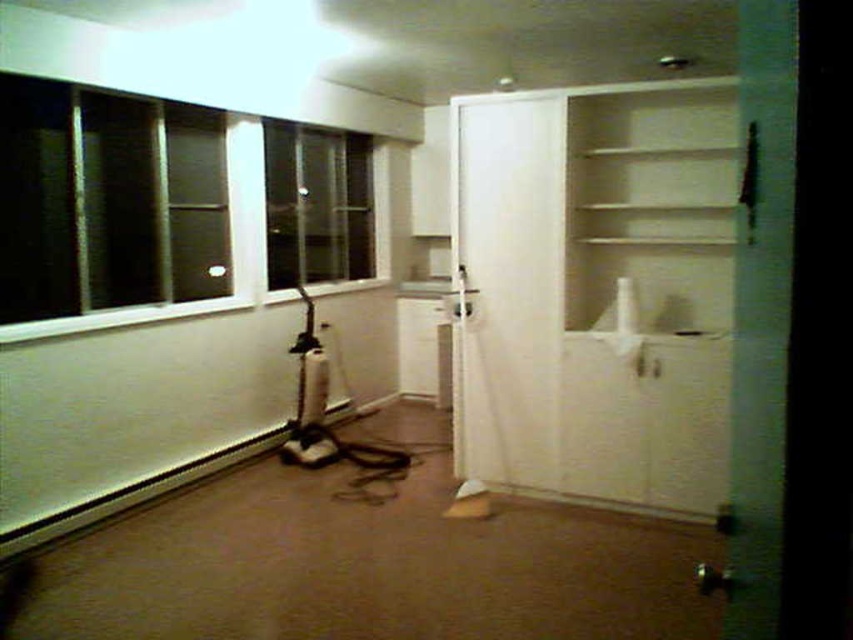
You are a delivery person who needs to place a large box in this room. The box is wider than the white matte cabinet at center. Can you fit the box through the clear glass window at upper left?

The white matte cabinet at center is wider than the clear glass window at upper left. Since the box is wider than the cabinet, it will also be wider than the window, so the box cannot fit through the clear glass window at upper left.

You are a delivery person who needs to place a large package in this room. The package is 1.2 meters wide. You see the white matte cabinet at center and the dark glass window at left. Which object can the package fit in front of, considering their sizes?

The white matte cabinet at center is bigger than the dark glass window at left, so the package can fit in front of the white matte cabinet at center.